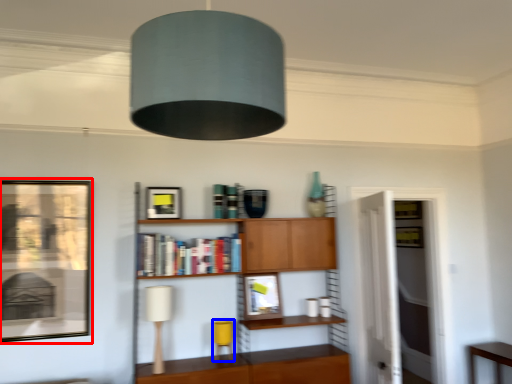
Question: Which object appears closest to the camera in this image, picture frame (highlighted by a red box) or table lamp (highlighted by a blue box)?

Choices:
 (A) picture frame
 (B) table lamp

Answer: (A)